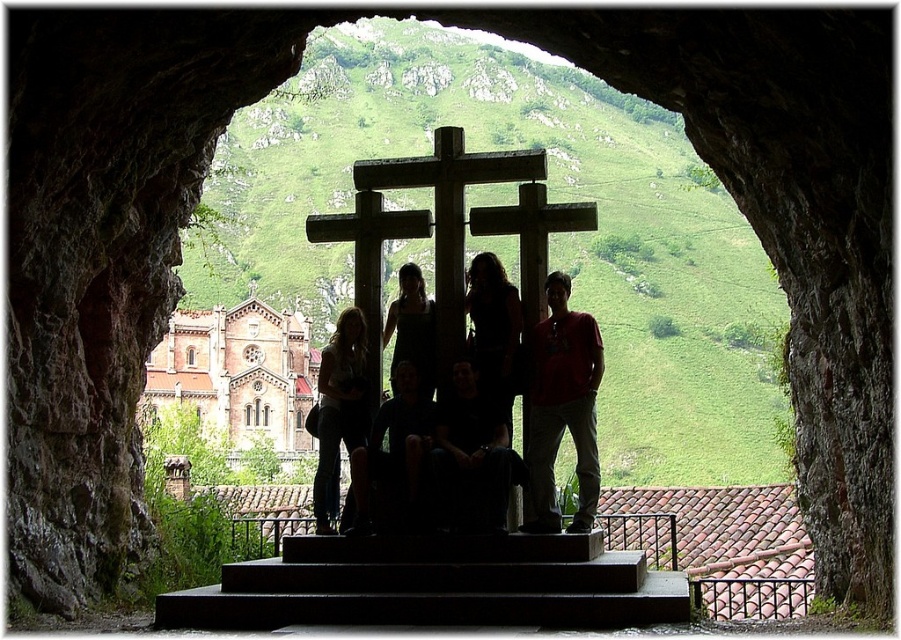
You are a photographer planning to take a group photo through the stone archway. You notice two people in the foreground wearing the black fabric at center and dark fabric pants at center. Which clothing item is shorter in length?

The black fabric at center is shorter than the dark fabric pants at center.

You are standing at the cave entrance and see two points marked in the image. The first point is at coordinates point (581, 332) and the second is at point (412, 433). Which point is closer to the cave entrance?

Point (412, 433) is closer to the cave entrance because it is in front of point (581, 332), which is behind it.